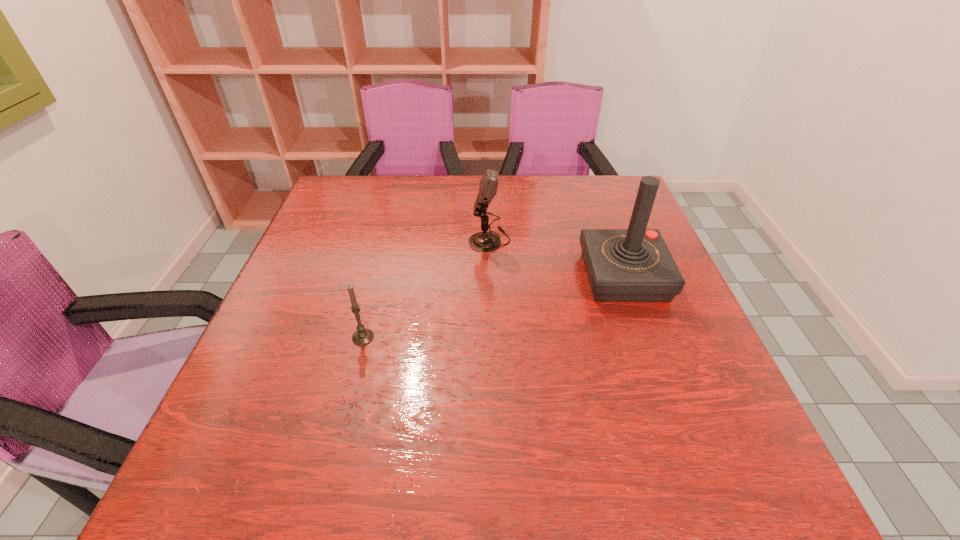
Find the location of a particular element. joystick is located at coordinates (623, 265).

Identify the location of the rightmost object. (623, 265).

Image resolution: width=960 pixels, height=540 pixels. Find the location of `the second tallest object`. the second tallest object is located at coordinates (484, 241).

You are a GUI agent. You are given a task and a screenshot of the screen. Output one action in this format:
    pyautogui.click(x=<x>, y=<y>)
    Task: Click on the microphone
    This screenshot has width=960, height=540.
    Given the screenshot: What is the action you would take?
    [x=484, y=241]

Where is `the nearest object`? This screenshot has height=540, width=960. the nearest object is located at coordinates (363, 336).

The width and height of the screenshot is (960, 540). Find the location of `the shortest object`. the shortest object is located at coordinates (363, 336).

The image size is (960, 540). Identify the location of free space located 0.390m on the rectangular base of the tallest object. (421, 276).

You are a GUI agent. You are given a task and a screenshot of the screen. Output one action in this format:
    pyautogui.click(x=<x>, y=<y>)
    Task: Click on the vacant space situated 0.260m on the rectangular base of the tallest object
    This screenshot has width=960, height=540.
    Given the screenshot: What is the action you would take?
    pyautogui.click(x=475, y=276)

Locate an element on the screen. vacant space located on the rectangular base of the tallest object is located at coordinates (418, 276).

Find the location of a particular element. This screenshot has width=960, height=540. vacant space situated 0.250m on the front-facing side of the second object from right to left is located at coordinates click(374, 240).